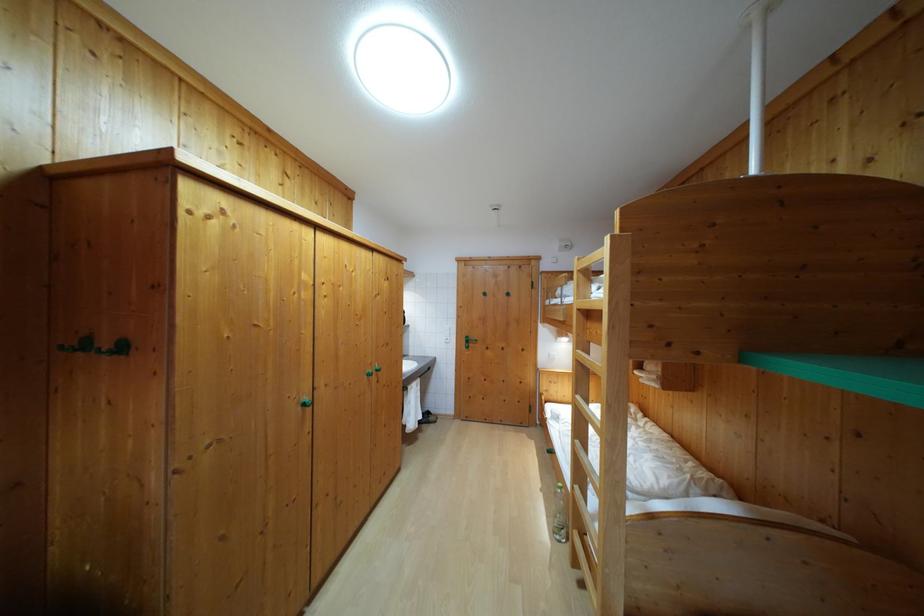
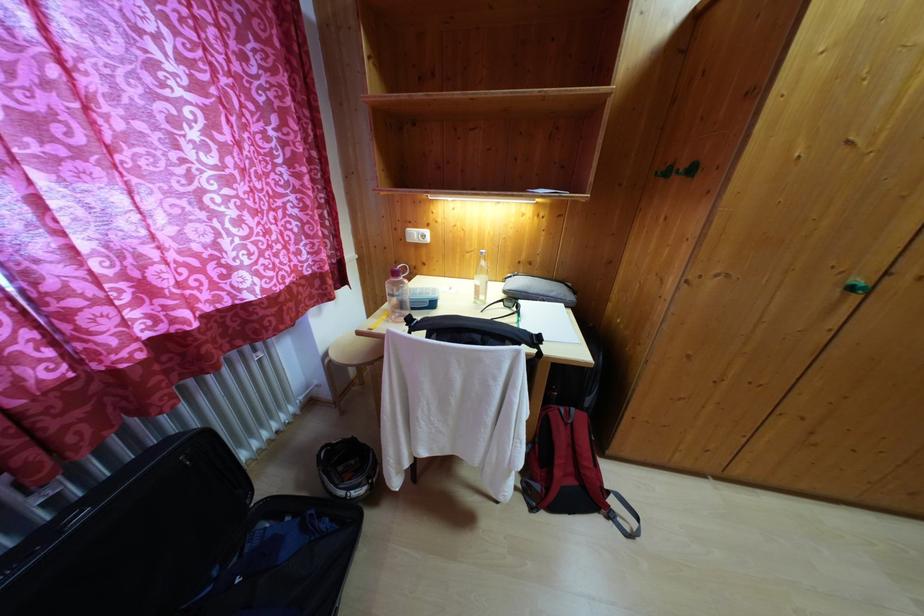
In the scene shown: The images are taken continuously from a first-person perspective. In which direction is your viewpoint rotating?

The camera's rotation is toward left-down.